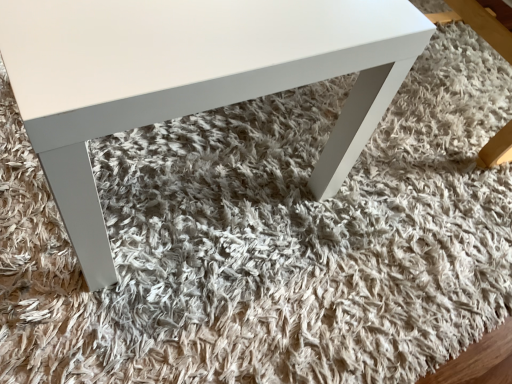
The image size is (512, 384). Identify the location of spots to the right of white glossy table at center. (375, 227).